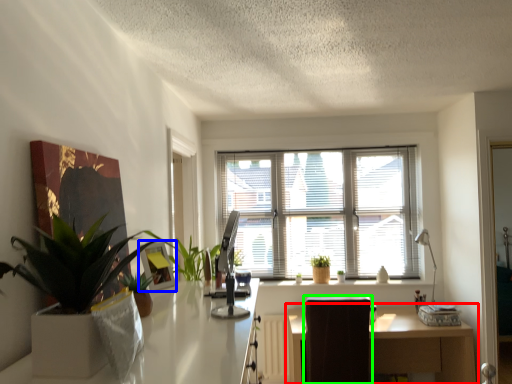
Question: Considering the real-world distances, which object is closest to table (highlighted by a red box)? picture frame (highlighted by a blue box) or swivel chair (highlighted by a green box).

Choices:
 (A) picture frame
 (B) swivel chair

Answer: (B)